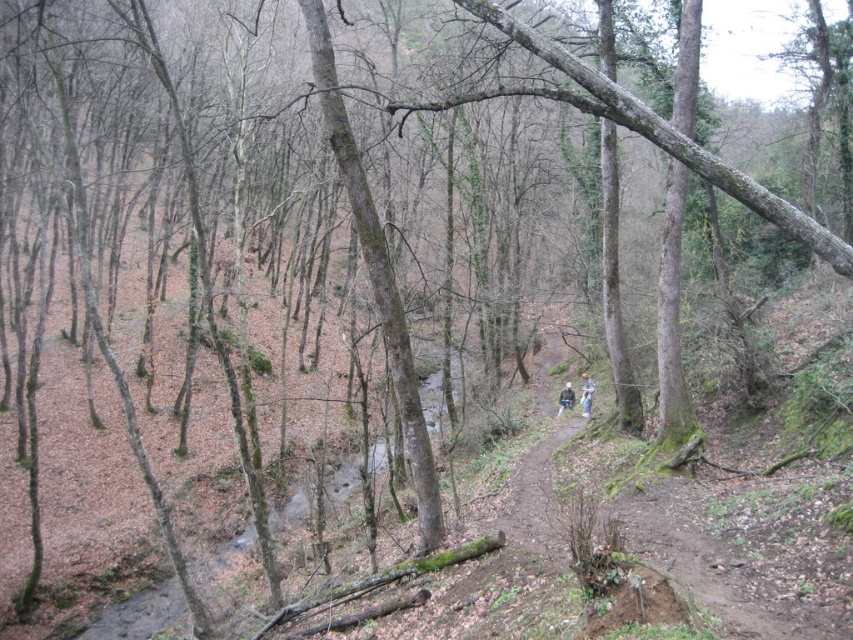
From the picture: You are a hiker who has just spotted two pairs of clothing items lying on the forest floor at the center of the path. The items are labeled as blue denim jeans at center and blue fabric pants at center. Which item appears taller when viewed from above?

The blue denim jeans at center appears much taller than the blue fabric pants at center when viewed from above.